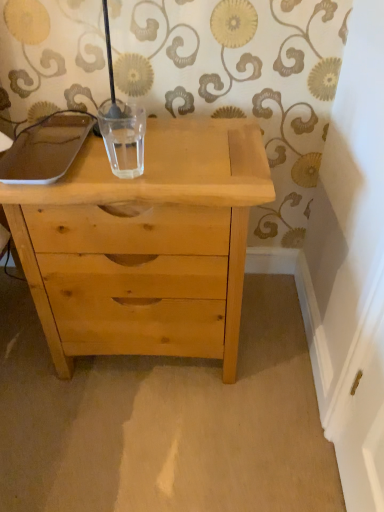
Question: In the image, is natural wood chest of drawers at center positioned in front of or behind transparent glass at center?

Choices:
 (A) behind
 (B) front

Answer: (B)

Question: In terms of width, does natural wood chest of drawers at center look wider or thinner when compared to transparent glass at center?

Choices:
 (A) wide
 (B) thin

Answer: (A)

Question: Is natural wood chest of drawers at center inside the boundaries of transparent glass at center, or outside?

Choices:
 (A) outside
 (B) inside

Answer: (A)

Question: In the image, is transparent glass at center on the left side or the right side of natural wood chest of drawers at center?

Choices:
 (A) right
 (B) left

Answer: (B)

Question: From the image's perspective, relative to natural wood chest of drawers at center, is transparent glass at center above or below?

Choices:
 (A) above
 (B) below

Answer: (A)

Question: Is point (124, 166) closer or farther from the camera than point (206, 139)?

Choices:
 (A) farther
 (B) closer

Answer: (B)

Question: Looking at the image, does transparent glass at center seem bigger or smaller compared to natural wood chest of drawers at center?

Choices:
 (A) small
 (B) big

Answer: (A)